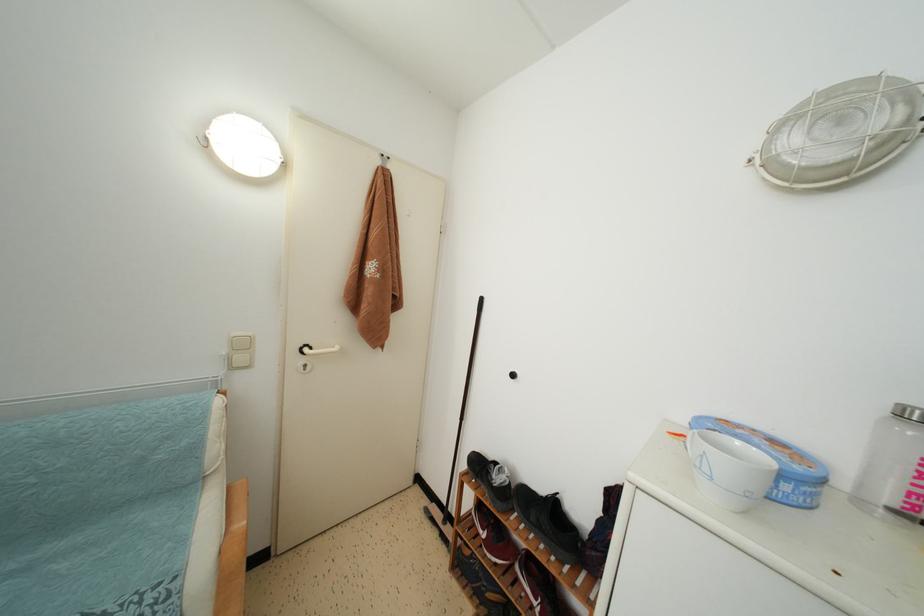
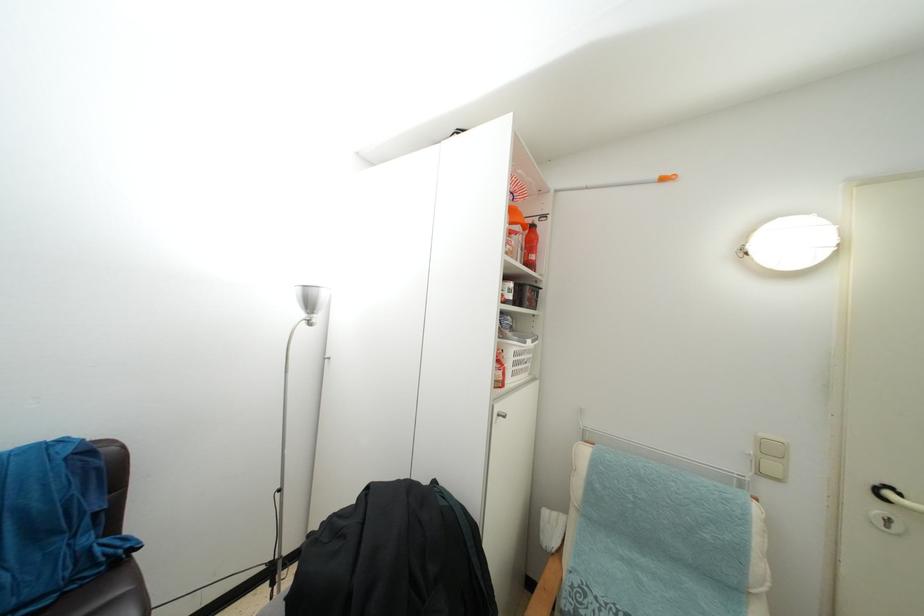
Where in the second image is the point corresponding to [310,355] from the first image?

(893, 500)